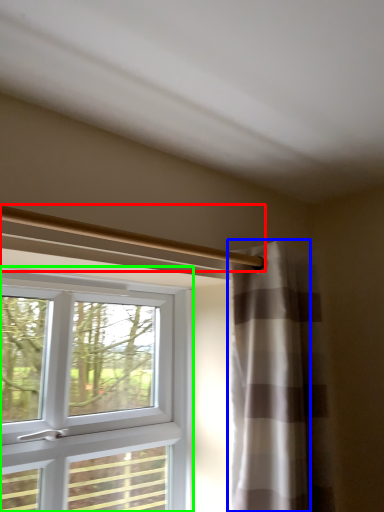
Question: Considering the real-world distances, which object is farthest from beam (highlighted by a red box)? curtain (highlighted by a blue box) or window (highlighted by a green box)?

Choices:
 (A) curtain
 (B) window

Answer: (B)